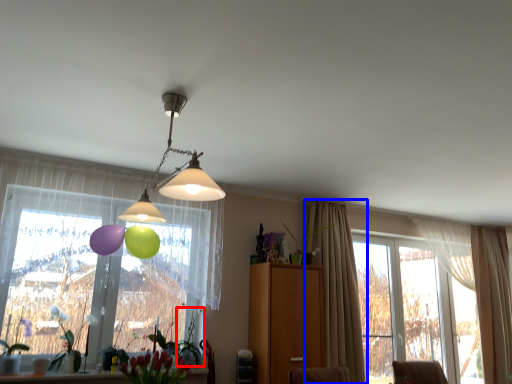
Question: Which object appears closest to the camera in this image, plant (highlighted by a red box) or curtain (highlighted by a blue box)?

Choices:
 (A) plant
 (B) curtain

Answer: (A)